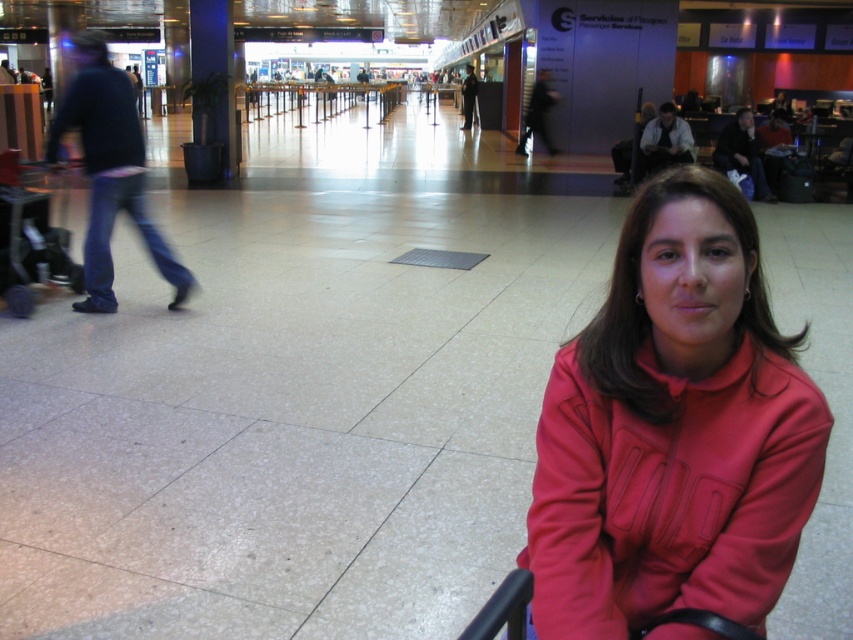
Who is more forward, (694, 404) or (109, 214)?

Point (694, 404)

The height and width of the screenshot is (640, 853). In order to click on matte red jacket at lower right in this screenshot , I will do `click(672, 429)`.

Identify the location of matte red jacket at lower right. (672, 429).